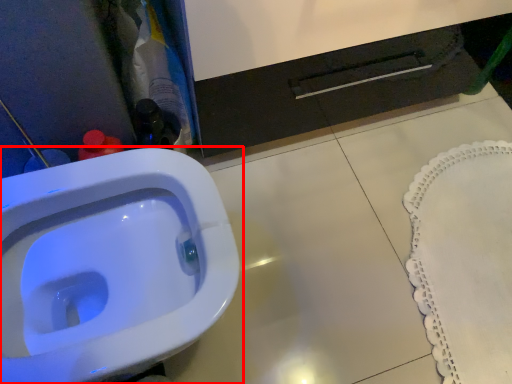
Question: From the image's perspective, where is toilet (annotated by the red box) located in relation to bath mat in the image?

Choices:
 (A) below
 (B) above

Answer: (A)